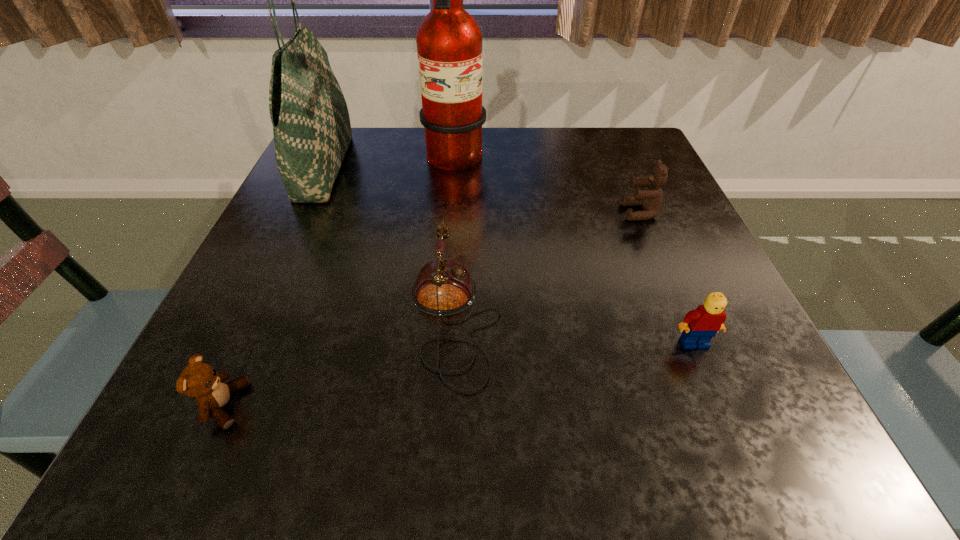
Locate an element on the screen. The height and width of the screenshot is (540, 960). free space between the Lego and the taller teddy bear is located at coordinates (667, 278).

Image resolution: width=960 pixels, height=540 pixels. What are the coordinates of `vacant space in between the nearer teddy bear and the fire extinguisher` in the screenshot? It's located at (339, 284).

Locate an element on the screen. free point between the tote bag and the taller teddy bear is located at coordinates point(483,190).

Where is `unoccupied position between the tote bag and the shorter teddy bear`? The image size is (960, 540). unoccupied position between the tote bag and the shorter teddy bear is located at coordinates (275, 286).

Locate an element on the screen. The height and width of the screenshot is (540, 960). free spot between the tote bag and the Lego is located at coordinates (510, 254).

The image size is (960, 540). I want to click on vacant area that lies between the left teddy bear and the tote bag, so click(x=275, y=286).

Find the location of a particular element. empty space between the Lego and the telephone is located at coordinates (574, 331).

Locate an element on the screen. The width and height of the screenshot is (960, 540). vacant space that's between the telephone and the tote bag is located at coordinates (390, 243).

Locate an element on the screen. The image size is (960, 540). empty space that is in between the telephone and the Lego is located at coordinates (574, 331).

Locate which object ranks fourth in proximity to the nearer teddy bear. Please provide its 2D coordinates. Your answer should be formatted as a tuple, i.e. [(x, y)], where the tuple contains the x and y coordinates of a point satisfying the conditions above.

[(700, 325)]